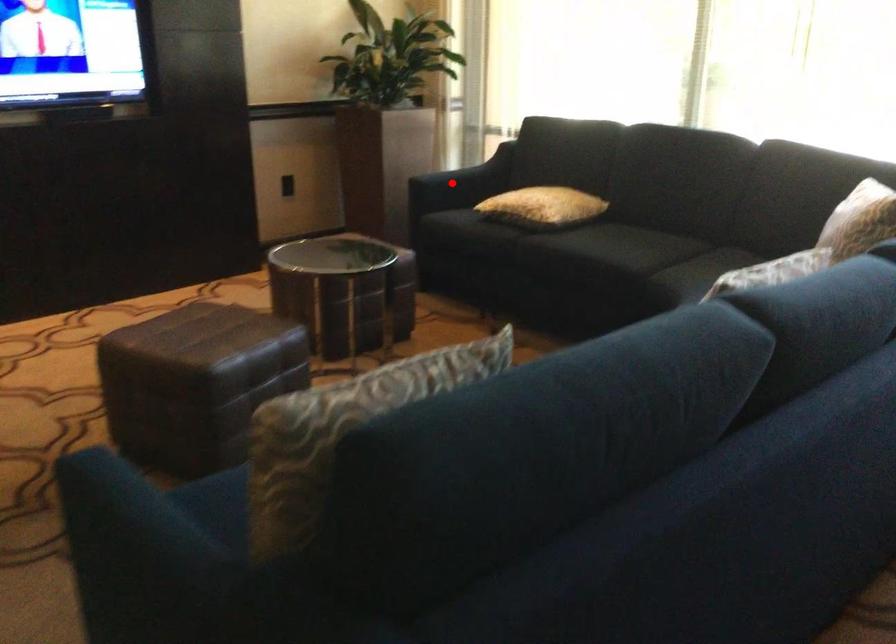
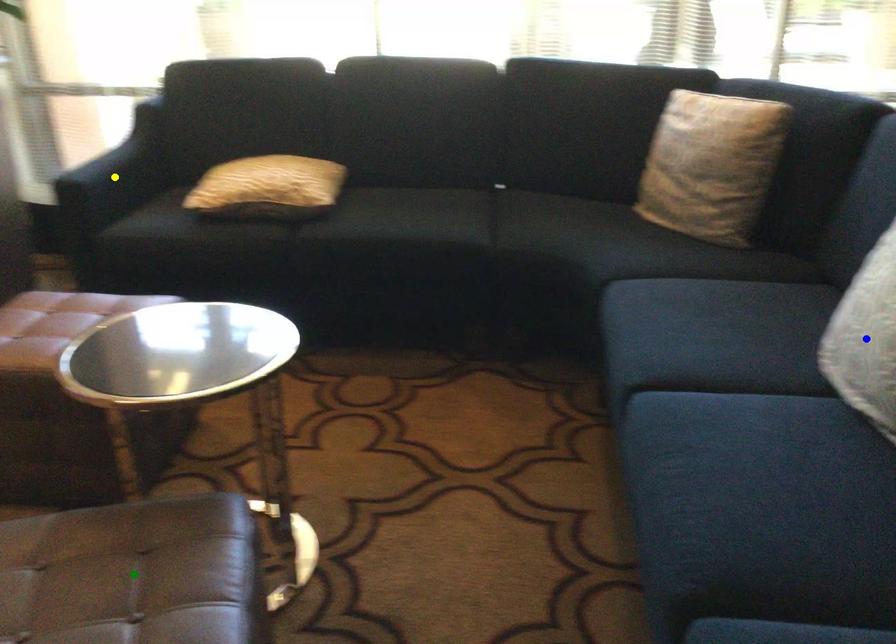
Question: I am providing you with two images of the same scene from different viewpoints. A red point is marked on the first image. You are given multiple points on the second image. Which spot in image 2 lines up with the point in image 1?

Choices:
 (A) blue point
 (B) yellow point
 (C) green point

Answer: (B)